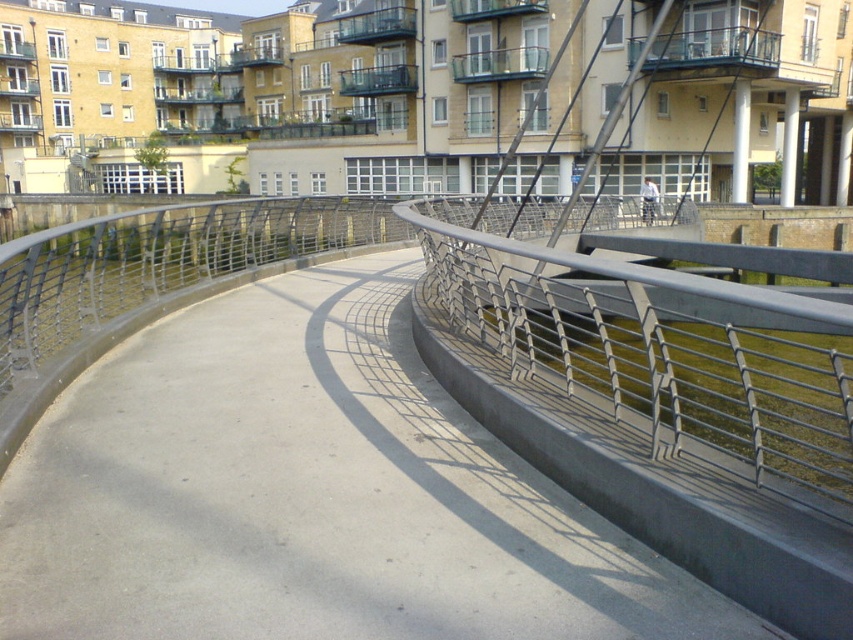
You are a delivery person carrying a large package and need to cross the pedestrian bridge. The path you need to take is the smooth concrete path at center. If your delivery vehicle is 4 meters long, will it fit entirely on the path?

The smooth concrete path at center is 3.99 meters from camera. Since the path is only 3.99 meters long, which is slightly shorter than the 4 meters required for your delivery vehicle, it will not fit entirely on the path.

You are a maintenance worker needing to inspect both the smooth concrete path at center and the metallic gray railing at center on the pedestrian bridge. Which object should you check first if you start from the top of the bridge?

You should check the metallic gray railing at center first because the smooth concrete path at center is located below it, meaning the railing is higher up and accessible from the top first.